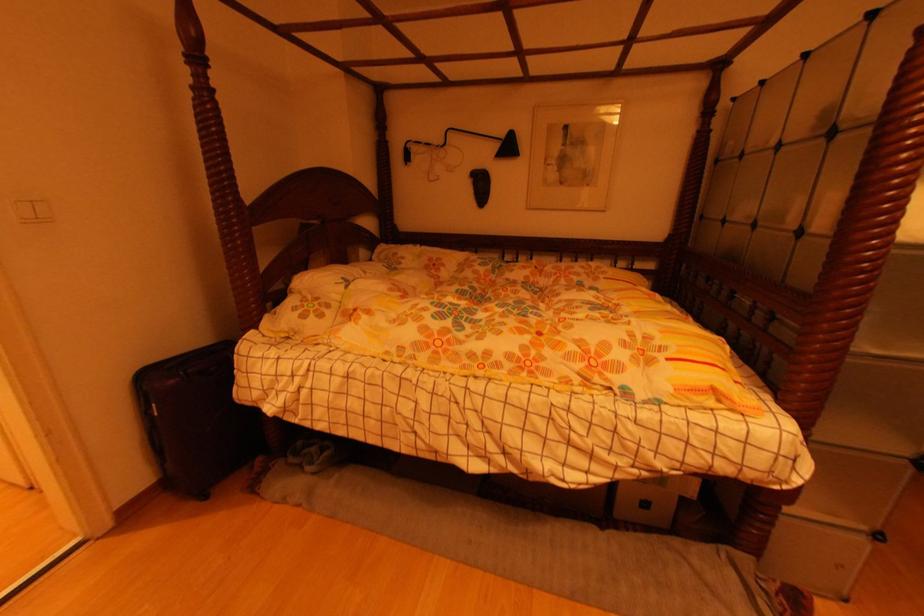
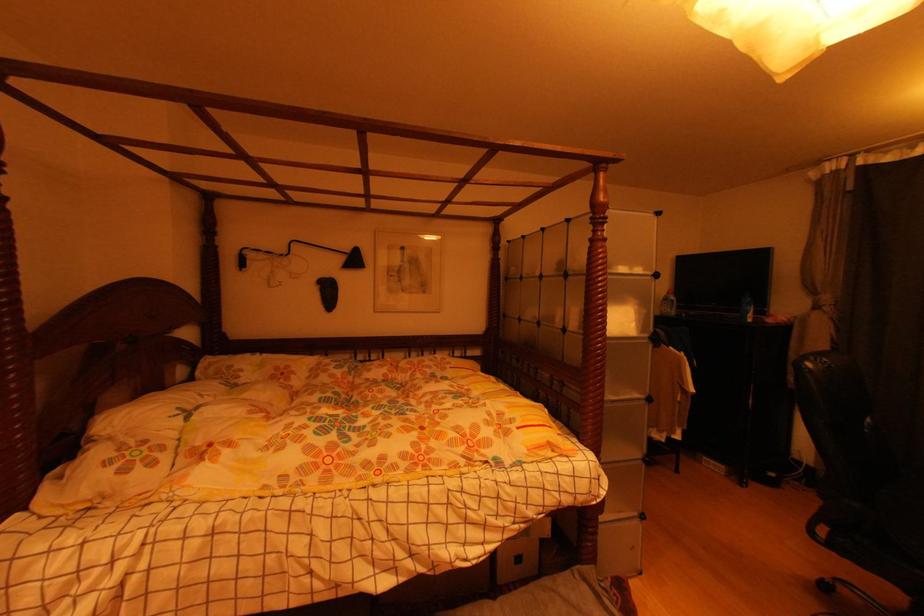
Question: How did the camera likely rotate?

Choices:
 (A) Left
 (B) Right
 (C) Up
 (D) Down

Answer: (B)